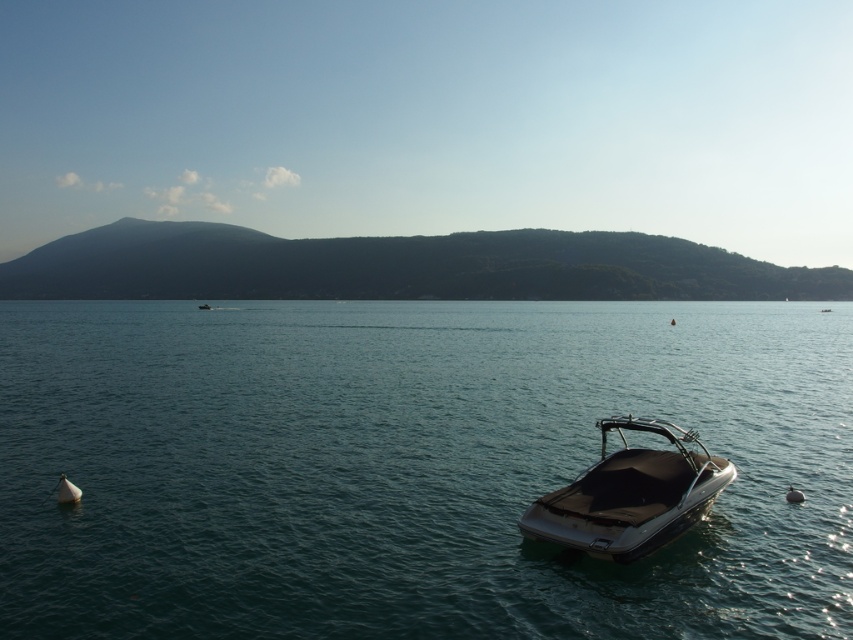
Question: Is clear blue water at center behind shiny black boat at lower right?

Choices:
 (A) no
 (B) yes

Answer: (A)

Question: Which point is closer to the camera taking this photo?

Choices:
 (A) (38, 316)
 (B) (659, 472)

Answer: (B)

Question: Among these objects, which one is farthest from the camera?

Choices:
 (A) shiny black boat at lower right
 (B) clear blue water at center

Answer: (A)

Question: Considering the relative positions of clear blue water at center and shiny black boat at lower right in the image provided, where is clear blue water at center located with respect to shiny black boat at lower right?

Choices:
 (A) above
 (B) below

Answer: (A)

Question: Does clear blue water at center have a smaller size compared to shiny black boat at lower right?

Choices:
 (A) yes
 (B) no

Answer: (B)